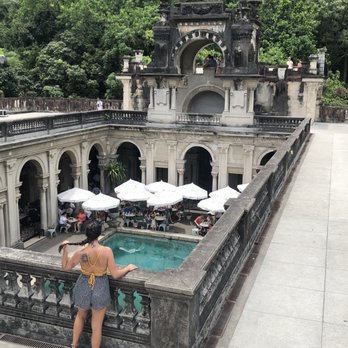
Where is `table`? The width and height of the screenshot is (348, 348). table is located at coordinates (71, 219), (158, 218), (203, 226), (172, 210).